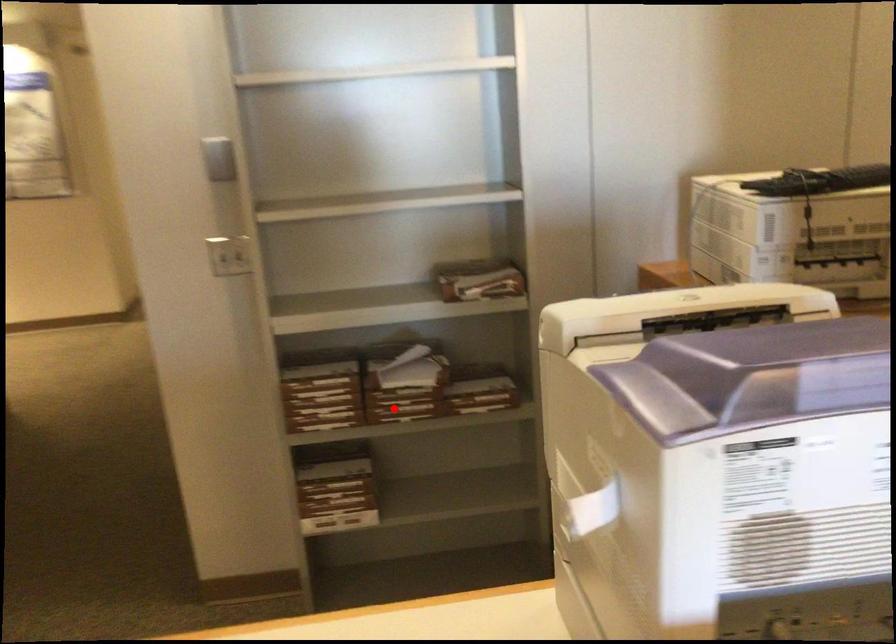
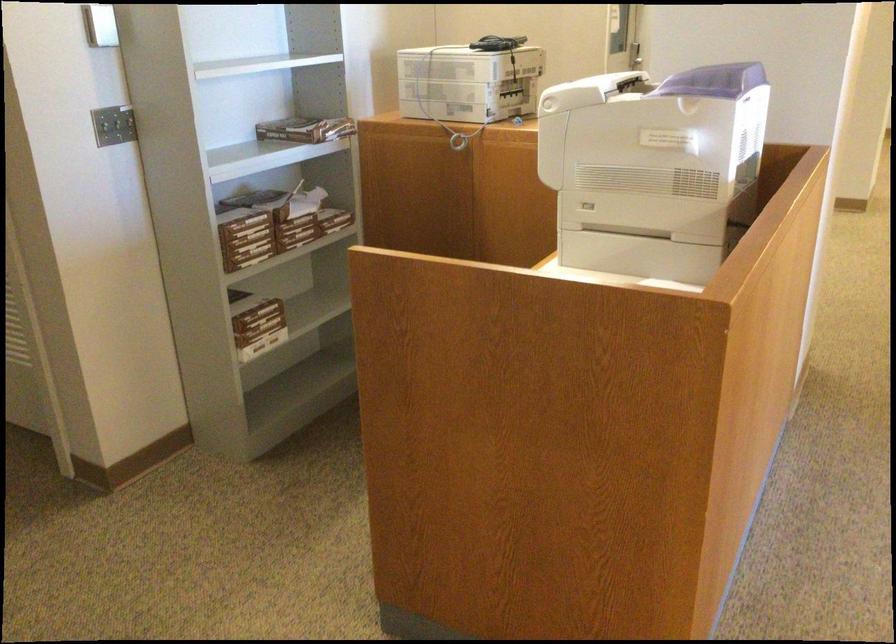
In the second image, find the point that corresponds to the highlighted location in the first image.

(297, 231)